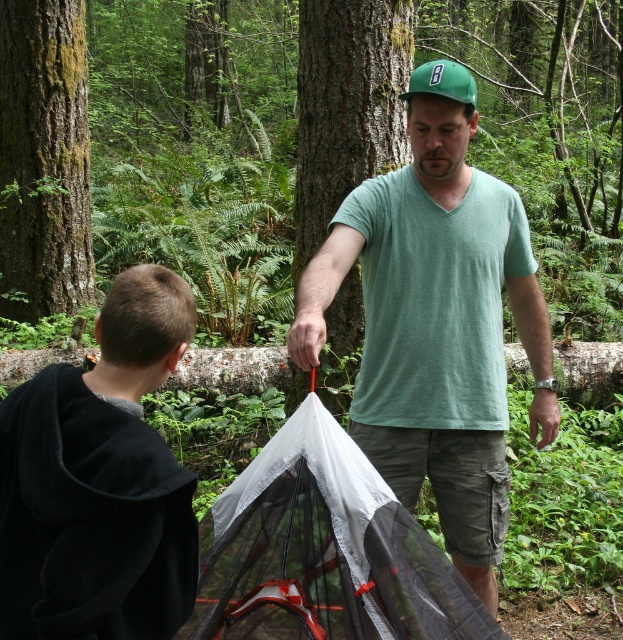
Is black fleece hoodie at lower left taller than green matte baseball cap at center?

Indeed, black fleece hoodie at lower left has a greater height compared to green matte baseball cap at center.

Which is behind, point (1, 588) or point (430, 68)?

Positioned behind is point (430, 68).

You are a GUI agent. You are given a task and a screenshot of the screen. Output one action in this format:
    pyautogui.click(x=<x>, y=<y>)
    Task: Click on the black fleece hoodie at lower left
    This screenshot has width=623, height=640.
    Given the screenshot: What is the action you would take?
    pyautogui.click(x=100, y=481)

Between transparent mesh tent at center and green matte baseball cap at center, which one has less height?

green matte baseball cap at center

Can you confirm if transparent mesh tent at center is bigger than green matte baseball cap at center?

Correct, transparent mesh tent at center is larger in size than green matte baseball cap at center.

Is point (328, 442) positioned before point (459, 67)?

Yes, point (328, 442) is in front of point (459, 67).

Find the location of a particular element. The height and width of the screenshot is (640, 623). transparent mesh tent at center is located at coordinates click(x=323, y=550).

Can you confirm if black fleece hoodie at lower left is thinner than transparent mesh tent at center?

Correct, black fleece hoodie at lower left's width is less than transparent mesh tent at center's.

Does point (188, 307) lie behind point (257, 576)?

No, (188, 307) is closer to viewer.

Find the location of `black fleece hoodie at lower left`. black fleece hoodie at lower left is located at coordinates (100, 481).